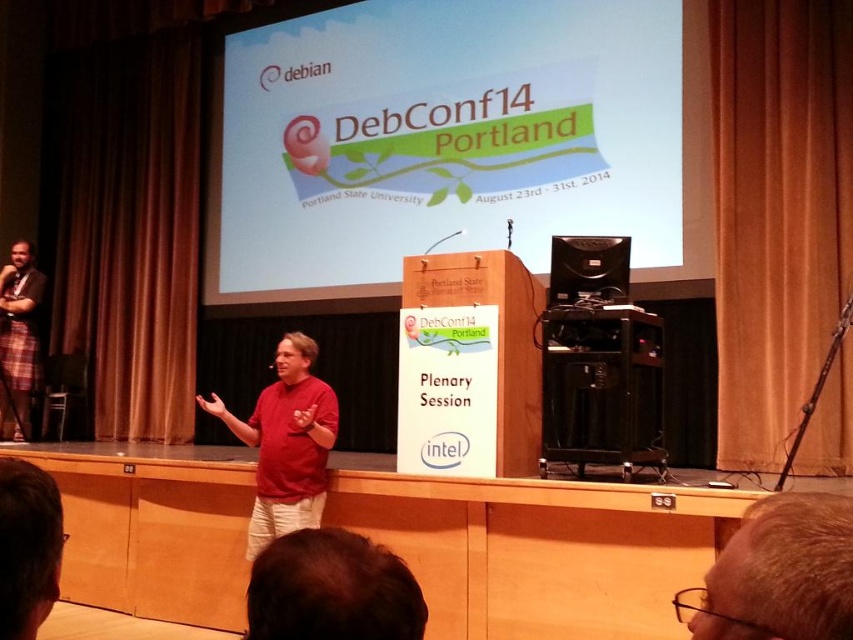
You are attending DebConf14 and notice two elements in the image. One is the light brown hair at lower right and the other is the plaid fabric at left. Which of these two elements is shorter in height?

The light brown hair at lower right is shorter in height compared to the plaid fabric at left because the description states that the light brown hair at lower right is not as tall as the plaid fabric at left.

You are a photographer positioned at the back of the DebConf14 plenary session. You need to capture a clear photo of both the matte red shirt at center and the black plastic speaker at center. Given that your camera has a depth of field that can sharply focus on objects within a 1.2 meter range, will both objects be in focus simultaneously?

The matte red shirt at center is 1.51 meters away from the black plastic speaker at center. Since the distance between them exceeds the camera lens depth of field range of 1.2 meters, it will be challenging to have both objects in focus simultaneously. Adjusting focus or using a different lens might be necessary.